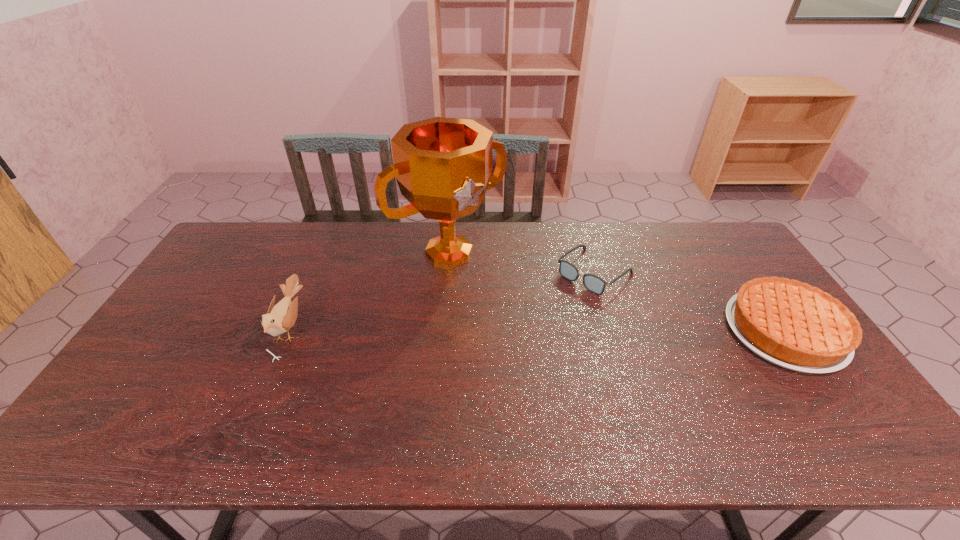
You are a GUI agent. You are given a task and a screenshot of the screen. Output one action in this format:
    pyautogui.click(x=<x>, y=<y>)
    Task: Click on the free space between the spectacles and the pie
    
    Given the screenshot: What is the action you would take?
    pyautogui.click(x=690, y=301)

In order to click on vacant space in between the third object from right to left and the pie in this screenshot , I will do `click(617, 291)`.

The width and height of the screenshot is (960, 540). I want to click on vacant area that lies between the shortest object and the rightmost object, so click(690, 301).

This screenshot has height=540, width=960. What are the coordinates of `vacant point located between the pie and the third shortest object` in the screenshot? It's located at (537, 329).

Locate an element on the screen. This screenshot has height=540, width=960. vacant point located between the shortest object and the second object from left to right is located at coordinates (522, 261).

The image size is (960, 540). I want to click on free point between the third shortest object and the second object from left to right, so click(x=370, y=289).

Identify which object is located as the third nearest to the rightmost object. Please provide its 2D coordinates. Your answer should be formatted as a tuple, i.e. [(x, y)], where the tuple contains the x and y coordinates of a point satisfying the conditions above.

[(280, 318)]

Image resolution: width=960 pixels, height=540 pixels. I want to click on object that can be found as the second closest to the tallest object, so click(x=280, y=318).